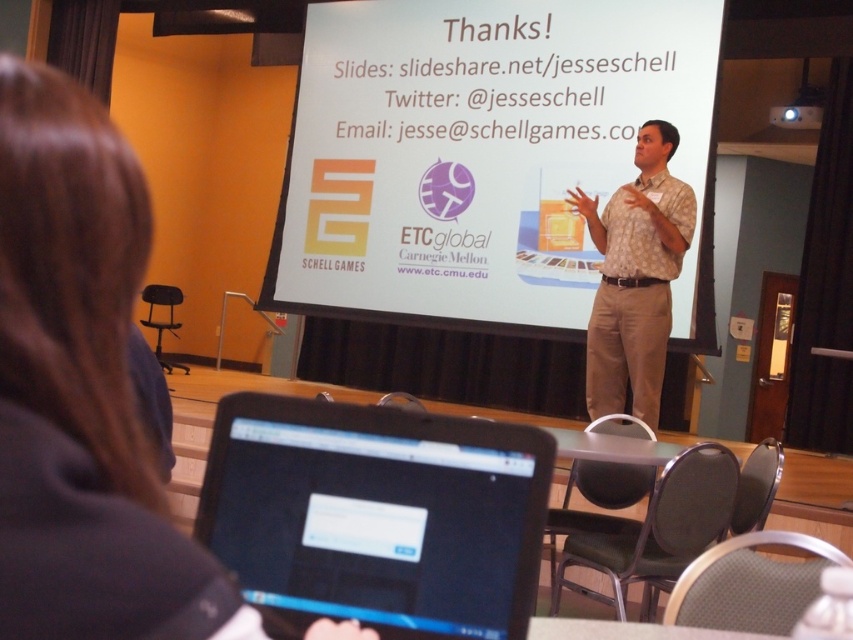
What do you see at coordinates (74, 371) in the screenshot?
I see `brown hair at upper left` at bounding box center [74, 371].

Is brown hair at upper left below brown patterned shirt at center?

Yes.

I want to click on brown hair at upper left, so click(x=74, y=371).

At what (x,y) coordinates should I click in order to perform the action: click on brown hair at upper left. Please return your answer as a coordinate pair (x, y). This screenshot has width=853, height=640. Looking at the image, I should click on (74, 371).

Measure the distance between point [549,77] and camera.

Point [549,77] and camera are 5.50 meters apart.

Does white paper at center appear on the right side of brown patterned shirt at center?

In fact, white paper at center is to the left of brown patterned shirt at center.

Is point (325, 54) farther from camera compared to point (665, 196)?

Yes, it is.

Find the location of `white paper at center`. white paper at center is located at coordinates (485, 157).

Who is higher up, brown hair at upper left or black glossy laptop at lower center?

brown hair at upper left

Which is more to the left, brown hair at upper left or black glossy laptop at lower center?

From the viewer's perspective, brown hair at upper left appears more on the left side.

Is point (10, 465) behind point (453, 588)?

No, (10, 465) is closer to viewer.

Locate an element on the screen. brown hair at upper left is located at coordinates (74, 371).